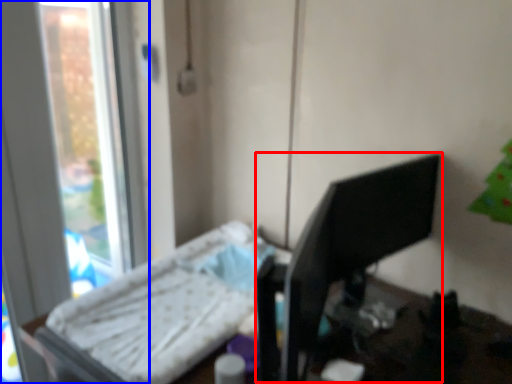
Question: Which of the following is the farthest to the observer, desktop computer (highlighted by a red box) or window (highlighted by a blue box)?

Choices:
 (A) desktop computer
 (B) window

Answer: (B)